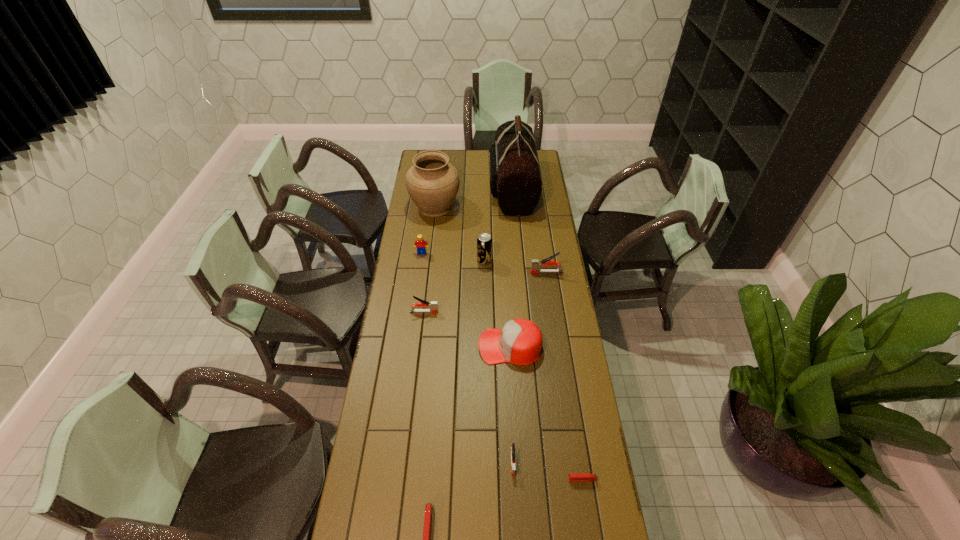
At what (x,y) coordinates should I click in order to perform the action: click on baseball cap. Please return your answer as a coordinate pair (x, y). The image size is (960, 540). Looking at the image, I should click on (520, 341).

Find the location of a particular element. This screenshot has height=540, width=960. the second farthest stapler is located at coordinates (433, 305).

You are a GUI agent. You are given a task and a screenshot of the screen. Output one action in this format:
    pyautogui.click(x=<x>, y=<y>)
    Task: Click on the fourth shortest stapler
    
    Given the screenshot: What is the action you would take?
    pyautogui.click(x=433, y=305)

The image size is (960, 540). Find the location of `the third shortest stapler`. the third shortest stapler is located at coordinates (512, 448).

The image size is (960, 540). Find the location of `the third nearest object`. the third nearest object is located at coordinates (512, 448).

Image resolution: width=960 pixels, height=540 pixels. I want to click on the shortest object, so click(573, 477).

Where is `the farther red stapler`? the farther red stapler is located at coordinates (573, 477).

Locate an element on the screen. The height and width of the screenshot is (540, 960). vacant space situated 0.350m on the front pocket of the red duffel bag is located at coordinates (427, 187).

This screenshot has height=540, width=960. What are the coordinates of `blank space located 0.110m on the front pocket of the red duffel bag` in the screenshot? It's located at (469, 187).

Where is `vacant space located on the front pocket of the red duffel bag`? The height and width of the screenshot is (540, 960). vacant space located on the front pocket of the red duffel bag is located at coordinates (436, 187).